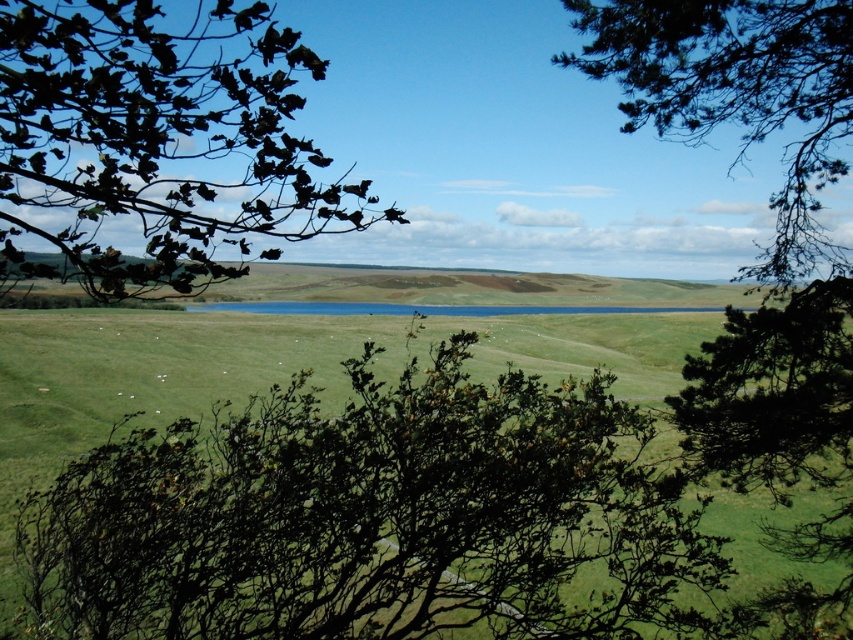
You are an artist sketching this scene. You want to draw the green leafy tree at center and the green leafy branches at upper left. Which object should you draw first to ensure proper layering?

You should draw the green leafy branches at upper left first because they are behind the green leafy tree at center, so they need to be placed in the background before the tree is added on top.

You are standing in the middle of the rural landscape and want to take a photo of the green leafy tree at center. Which direction should you face to ensure the tree is in the center of your camera view?

The green leafy tree at center is located at point coordinates, so you should face directly towards the center of the scene to capture it in the center of your camera view.